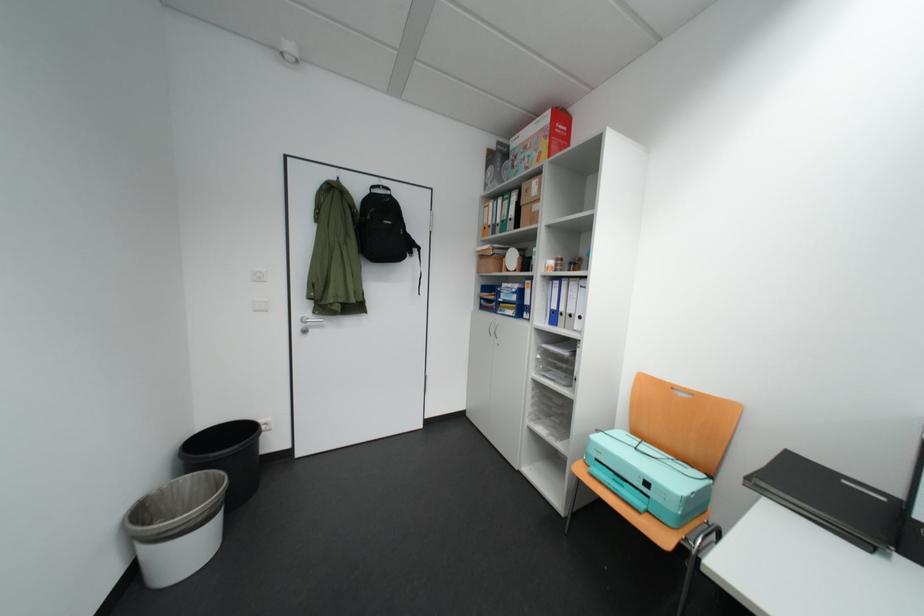
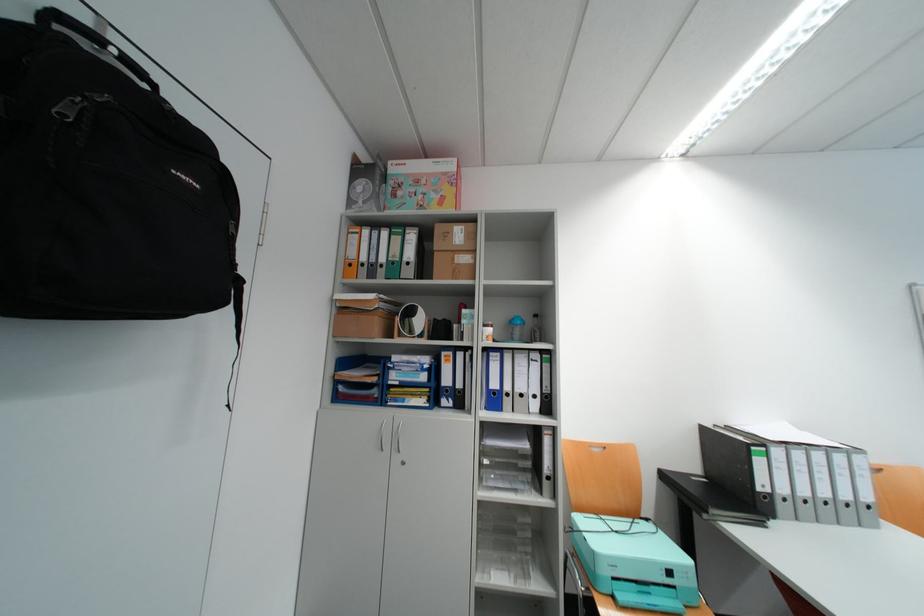
In the second image, find the point that corresponds to point (517, 302) in the first image.

(415, 387)